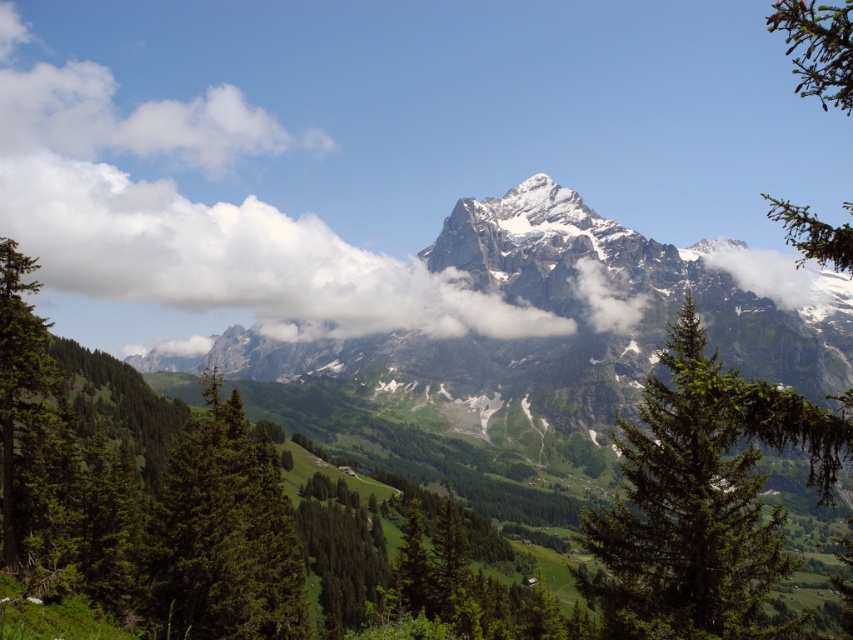
Question: Based on their relative distances, which object is farther from the snowy granite mountain range at center?

Choices:
 (A) green needle-like branches at upper right
 (B) green matte tree at center-left

Answer: (B)

Question: Is white fluffy cloud at upper center smaller than green matte tree at center-left?

Choices:
 (A) yes
 (B) no

Answer: (B)

Question: Can you confirm if green textured pine tree at center is positioned above green matte tree at center-left?

Choices:
 (A) yes
 (B) no

Answer: (A)

Question: Is green needle-like branches at upper right wider than green textured tree at left?

Choices:
 (A) no
 (B) yes

Answer: (B)

Question: Which point is farther to the camera?

Choices:
 (A) snowy granite mountain range at center
 (B) white fluffy cloud at upper center

Answer: (B)

Question: Which of these objects is positioned closest to the snowy granite mountain range at center?

Choices:
 (A) white fluffy cloud at upper center
 (B) green textured pine tree at center

Answer: (A)